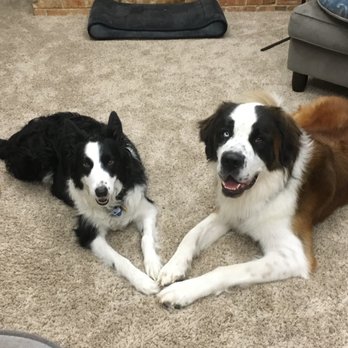
The image size is (348, 348). I want to click on chair leg, so click(x=295, y=83).